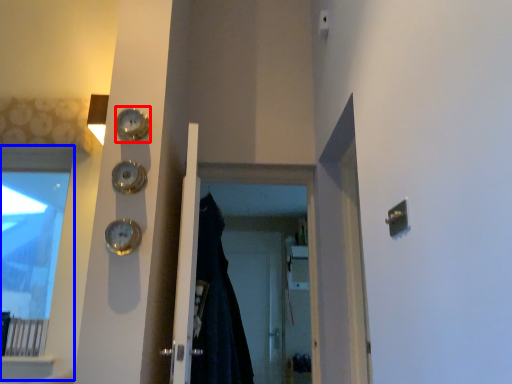
Question: Which point is closer to the camera, clock (highlighted by a red box) or window (highlighted by a blue box)?

Choices:
 (A) clock
 (B) window

Answer: (A)